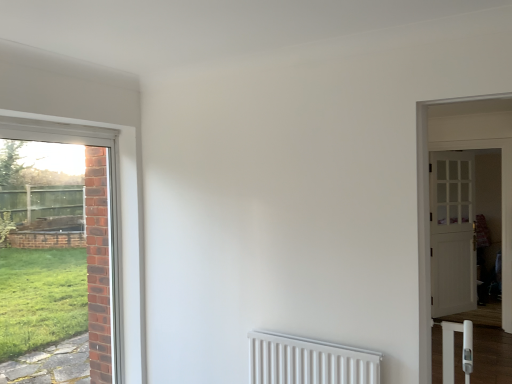
Question: From the image's perspective, is white wooden door at right, the first door from the right, located beneath matte glass door at left, which appears as the 3th door when viewed from the right?

Choices:
 (A) no
 (B) yes

Answer: (A)

Question: Is white wooden door at right, arranged as the 3th door when viewed from the left, bigger than matte glass door at left, which is counted as the 3th door, starting from the back?

Choices:
 (A) yes
 (B) no

Answer: (A)

Question: Can you confirm if white wooden door at right, the first door from the right, is shorter than matte glass door at left, which is counted as the 3th door, starting from the back?

Choices:
 (A) yes
 (B) no

Answer: (B)

Question: Is white wooden door at right, the 1th door when ordered from back to front, placed right next to matte glass door at left, placed as the 1th door when sorted from left to right?

Choices:
 (A) yes
 (B) no

Answer: (B)

Question: Is matte glass door at left, placed as the 1th door when sorted from left to right, located within white wooden door at right, the 1th door when ordered from back to front?

Choices:
 (A) no
 (B) yes

Answer: (A)

Question: Does white wooden door at right, the first door from the right, have a greater width compared to matte glass door at left, placed as the 1th door when sorted from left to right?

Choices:
 (A) yes
 (B) no

Answer: (A)

Question: Considering the relative positions of matte glass door at left, the 1th door viewed from the front, and white wooden door at right, the first door from the right, in the image provided, is matte glass door at left, the 1th door viewed from the front, to the right of white wooden door at right, the first door from the right, from the viewer's perspective?

Choices:
 (A) no
 (B) yes

Answer: (A)

Question: Is matte glass door at left, which appears as the 3th door when viewed from the right, behind white wooden door at right, arranged as the 3th door when viewed from the left?

Choices:
 (A) yes
 (B) no

Answer: (B)

Question: Does matte glass door at left, the 1th door viewed from the front, have a larger size compared to white wooden door at right, the third door from the front?

Choices:
 (A) no
 (B) yes

Answer: (A)

Question: Does matte glass door at left, placed as the 1th door when sorted from left to right, have a lesser height compared to white wooden door at right, the 1th door when ordered from back to front?

Choices:
 (A) yes
 (B) no

Answer: (A)

Question: Considering the relative sizes of matte glass door at left, which appears as the 3th door when viewed from the right, and white wooden door at right, the first door from the right, in the image provided, is matte glass door at left, which appears as the 3th door when viewed from the right, taller than white wooden door at right, the first door from the right,?

Choices:
 (A) no
 (B) yes

Answer: (A)

Question: Is the depth of matte glass door at left, which appears as the 3th door when viewed from the right, less than that of white wooden door at right, the third door from the front?

Choices:
 (A) yes
 (B) no

Answer: (A)

Question: Is matte glass door at left, the 1th door viewed from the front, wider than white wooden door at right, the 2th door in the back-to-front sequence?

Choices:
 (A) yes
 (B) no

Answer: (B)